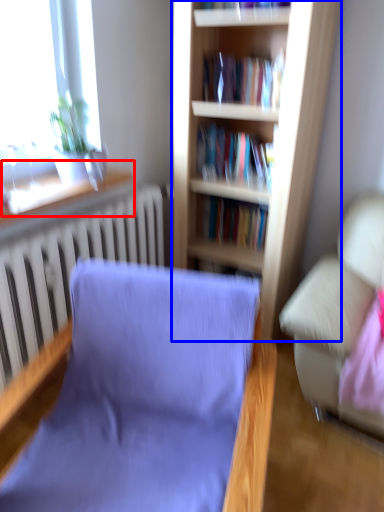
Question: Among these objects, which one is nearest to the camera, window sill (highlighted by a red box) or bookcase (highlighted by a blue box)?

Choices:
 (A) window sill
 (B) bookcase

Answer: (A)